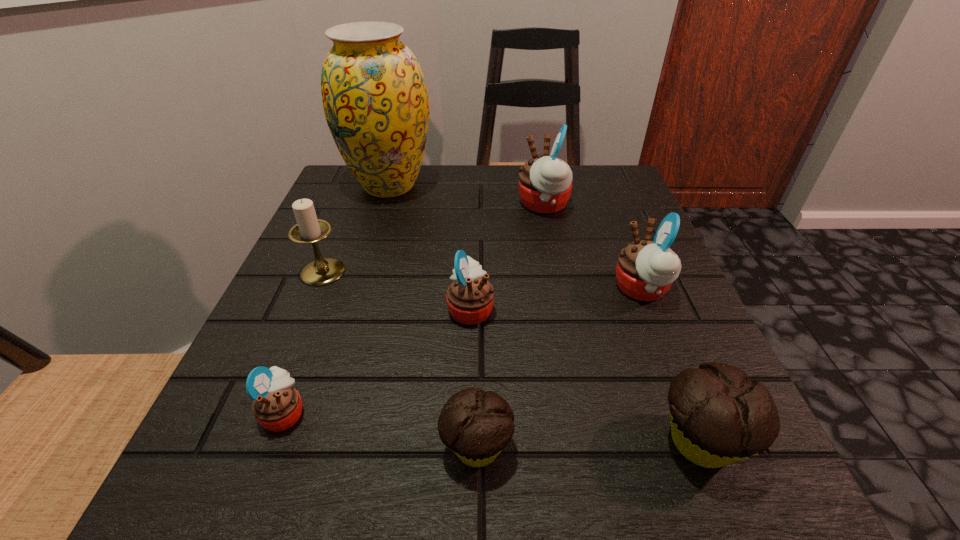
At what (x,y) coordinates should I click in order to perform the action: click on vacant area located 0.080m on the front-facing side of the second pink muffin from left to right. Please return your answer as a coordinate pair (x, y). This screenshot has width=960, height=540. Looking at the image, I should click on (541, 308).

Identify the location of vacant point located on the left of the bigger chocolate muffin. (615, 441).

Locate an element on the screen. The height and width of the screenshot is (540, 960). vacant space located 0.070m on the front-facing side of the leftmost muffin is located at coordinates [x=358, y=413].

Identify the location of vacant space located on the back of the left chocolate muffin. [477, 282].

At what (x,y) coordinates should I click in order to perform the action: click on vase present at the far edge. Please return your answer as a coordinate pair (x, y). The image size is (960, 540). Looking at the image, I should click on (375, 99).

You are a GUI agent. You are given a task and a screenshot of the screen. Output one action in this format:
    pyautogui.click(x=<x>, y=<y>)
    Task: Click on the muffin that is at the far edge
    This screenshot has height=540, width=960.
    Given the screenshot: What is the action you would take?
    pyautogui.click(x=545, y=183)

Image resolution: width=960 pixels, height=540 pixels. Identify the location of vase that is at the left edge. point(375,99).

Image resolution: width=960 pixels, height=540 pixels. I want to click on candle holder at the left edge, so click(x=309, y=229).

Where is `muffin that is at the left edge`? This screenshot has width=960, height=540. muffin that is at the left edge is located at coordinates (277, 406).

This screenshot has width=960, height=540. In order to click on object located at the far left corner in this screenshot , I will do `click(375, 99)`.